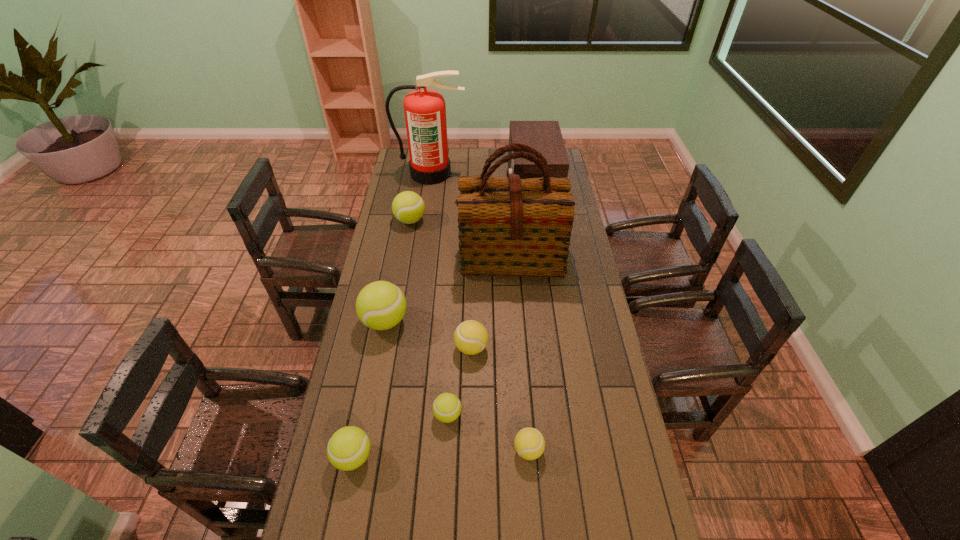
This screenshot has width=960, height=540. I want to click on red fire extinguisher, so coord(425,111).

Image resolution: width=960 pixels, height=540 pixels. I want to click on the sixth nearest object, so click(509, 226).

Where is `the seventh shortest object`? This screenshot has width=960, height=540. the seventh shortest object is located at coordinates (544, 136).

Find the location of `the tallest tennis ball`. the tallest tennis ball is located at coordinates (381, 305).

Locate an element on the screen. The width and height of the screenshot is (960, 540). the fourth tallest object is located at coordinates (381, 305).

In order to click on the third smallest green tennis ball in this screenshot , I will do `click(408, 207)`.

The image size is (960, 540). I want to click on the fifth shortest tennis ball, so click(x=408, y=207).

Identify the location of the bigger yellow tennis ball. Image resolution: width=960 pixels, height=540 pixels. (470, 337).

Locate an element on the screen. The width and height of the screenshot is (960, 540). the left yellow tennis ball is located at coordinates (470, 337).

Image resolution: width=960 pixels, height=540 pixels. I want to click on the third biggest green tennis ball, so click(x=348, y=448).